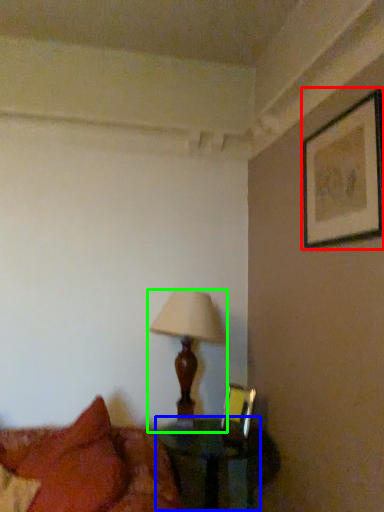
Question: Which object is the farthest from picture frame (highlighted by a red box)? Choose among these: table (highlighted by a blue box) or lamp (highlighted by a green box).

Choices:
 (A) table
 (B) lamp

Answer: (A)